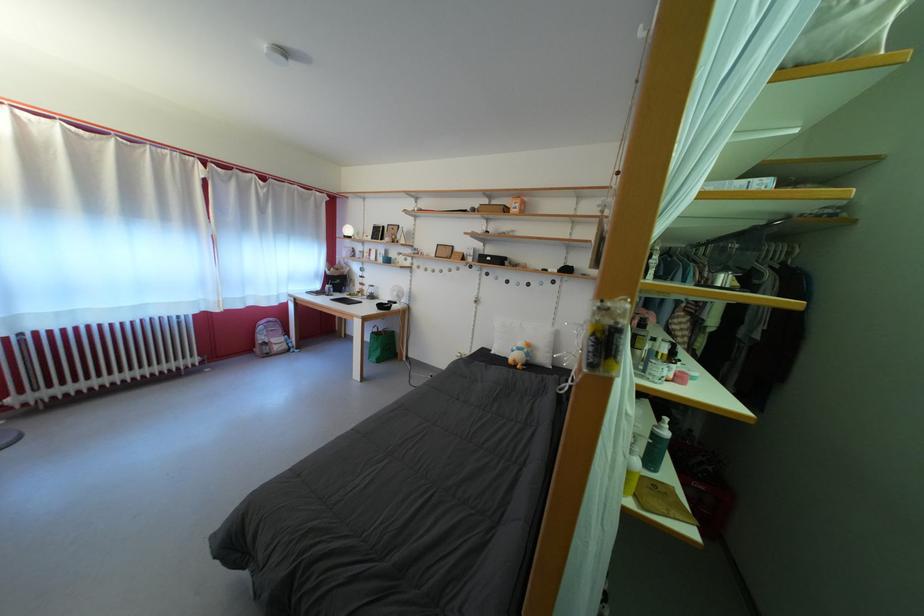
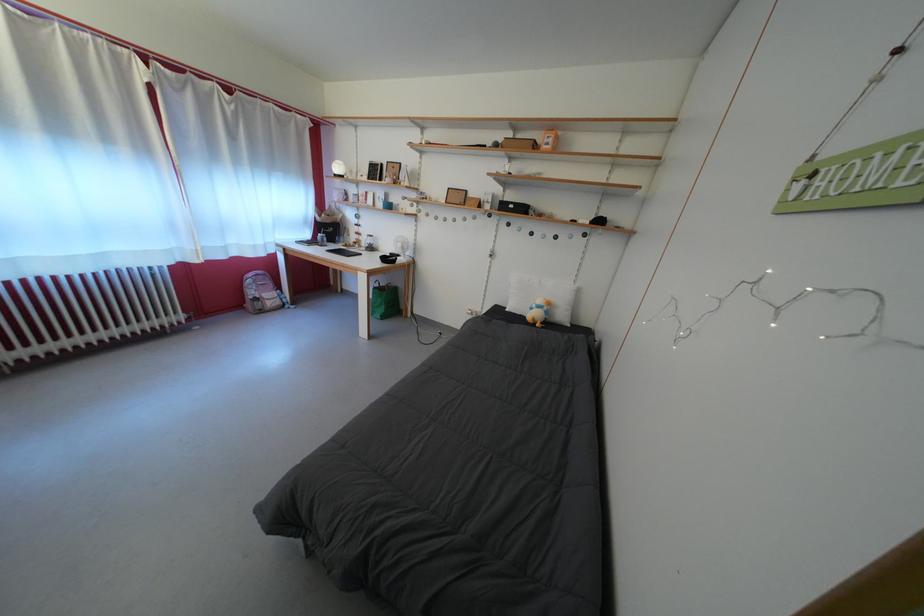
Question: I am providing you with two images of the same scene from different viewpoints. Which of the following objects are not visible in image2?

Choices:
 (A) small cardboard box
 (B) green tote bag
 (C) white pillow
 (D) none of these

Answer: (D)